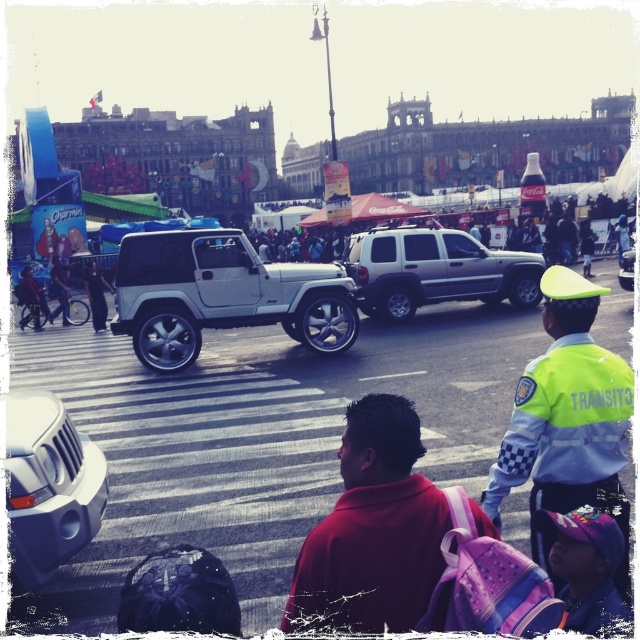
Question: Is silver metallic suv at center bigger than matte black bicycle at left?

Choices:
 (A) no
 (B) yes

Answer: (B)

Question: Which object is positioned farthest from the dark gray uniform at center?

Choices:
 (A) satin silver suv at center
 (B) silver metallic suv at center
 (C) silver metallic car at center
 (D) matte black bicycle at left

Answer: (A)

Question: Does silver metallic jeep at center have a smaller size compared to silver metallic car at center?

Choices:
 (A) no
 (B) yes

Answer: (A)

Question: Among these objects, which one is farthest from the camera?

Choices:
 (A) red matte jacket at center
 (B) silver metallic jeep at center
 (C) satin silver suv at center

Answer: (C)

Question: Estimate the real-world distances between objects in this image. Which object is farther from the silver metallic car at center?

Choices:
 (A) matte silver suv at center
 (B) satin silver suv at center
 (C) silver metallic suv at center

Answer: (B)

Question: Does red matte jacket at center have a lesser width compared to reflective silver helmet at center?

Choices:
 (A) yes
 (B) no

Answer: (B)